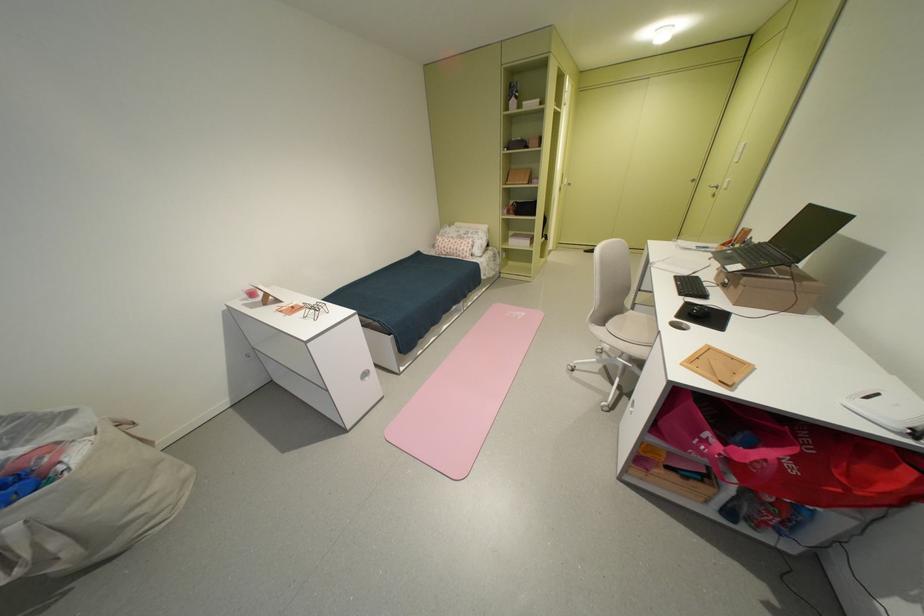
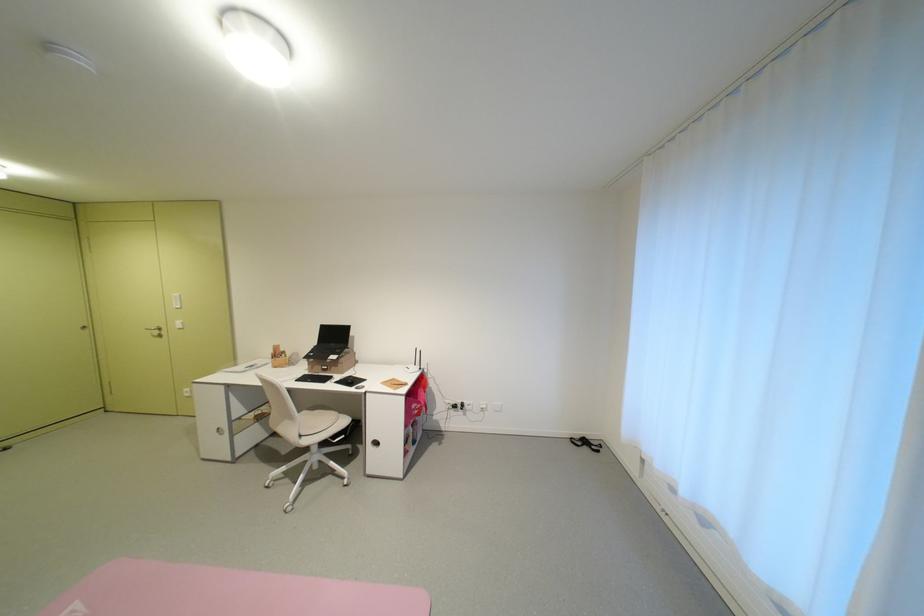
Locate, in the second image, the point that corresponds to [776,241] in the first image.

(324, 345)